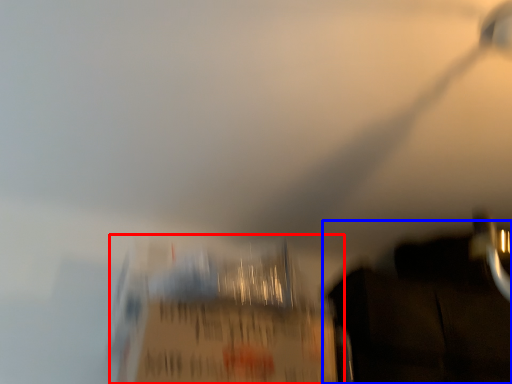
Question: Which object is closer to the camera taking this photo, cardboard box (highlighted by a red box) or dark (highlighted by a blue box)?

Choices:
 (A) cardboard box
 (B) dark

Answer: (A)